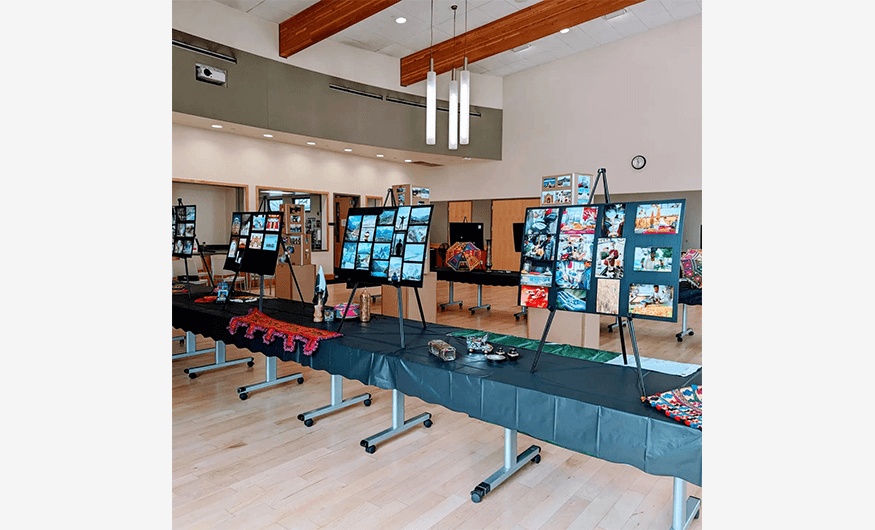
Locate an element on the screen. chandelier is located at coordinates (452, 112).